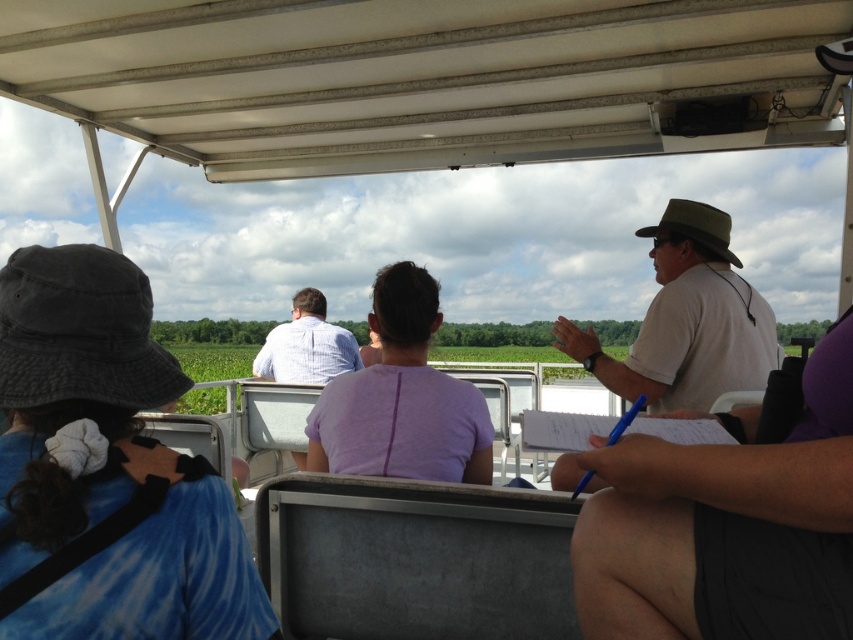
Between blue tie-dye shirt at upper left and purple matte shirt at center, which one has more height?

purple matte shirt at center

Between point (68, 557) and point (409, 308), which one is positioned in front?

Point (68, 557) is in front.

I want to click on blue tie-dye shirt at upper left, so click(x=105, y=468).